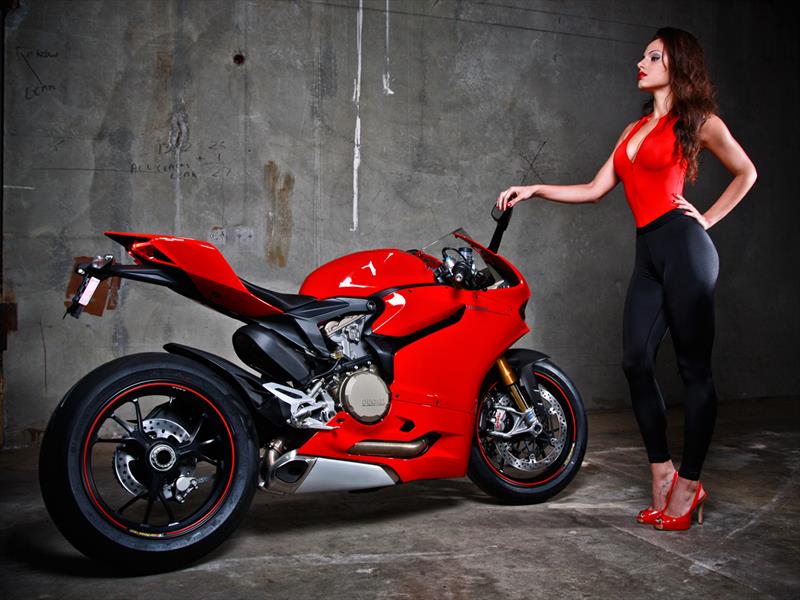
At what (x,y) coordinates should I click in order to perform the action: click on wall. Please return your answer as a coordinate pair (x, y). The height and width of the screenshot is (600, 800). Looking at the image, I should click on (380, 37).